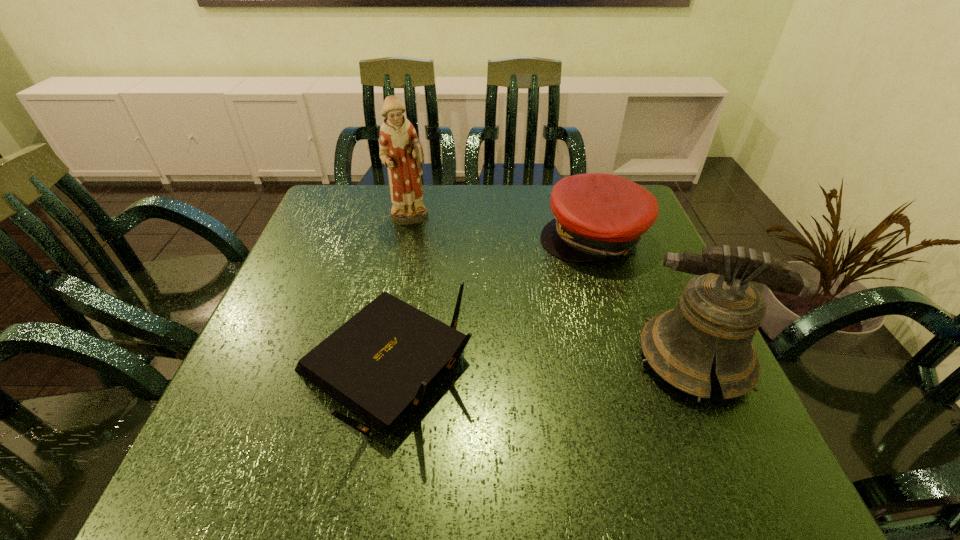
The height and width of the screenshot is (540, 960). Find the location of `free space on the desktop that is between the router and the second tallest object and is positioned on the front-facing side of the cap`. free space on the desktop that is between the router and the second tallest object and is positioned on the front-facing side of the cap is located at coordinates [538, 364].

This screenshot has width=960, height=540. In order to click on vacant space on the desktop that is between the router and the second tallest object and is positioned on the front-facing side of the figurine in this screenshot , I will do `click(494, 365)`.